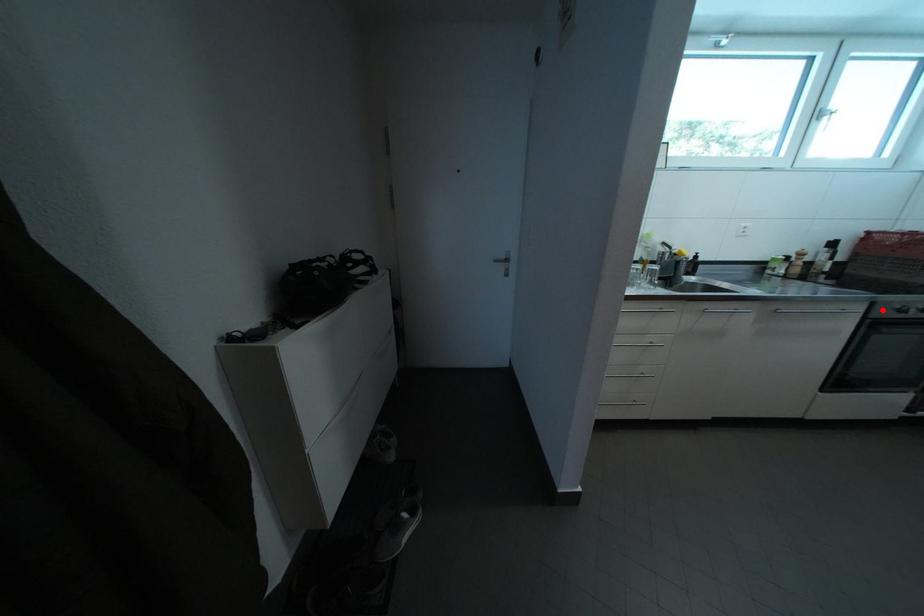
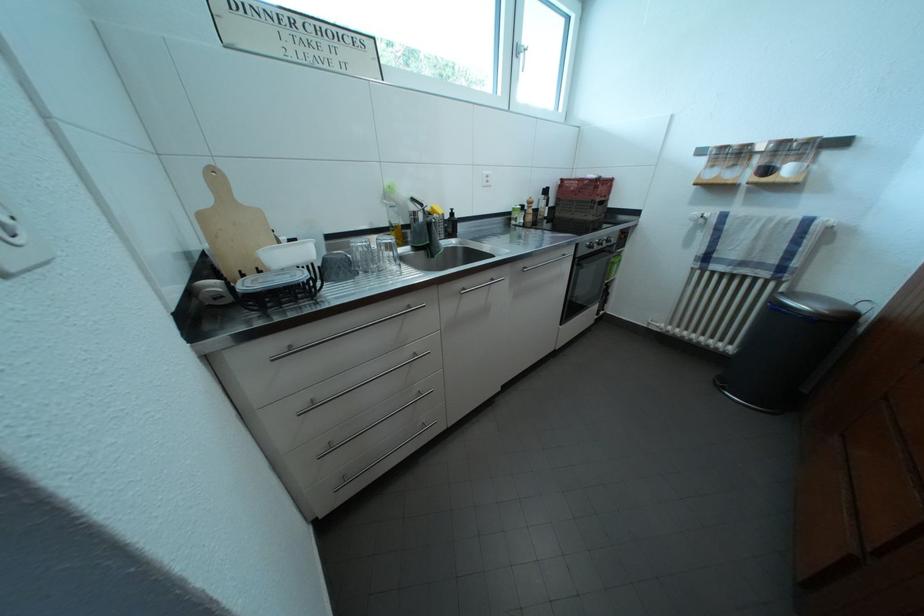
Locate, in the second image, the point that corresponds to the highlighted location in the first image.

(587, 251)